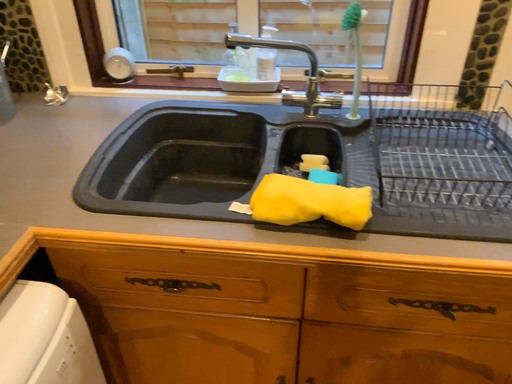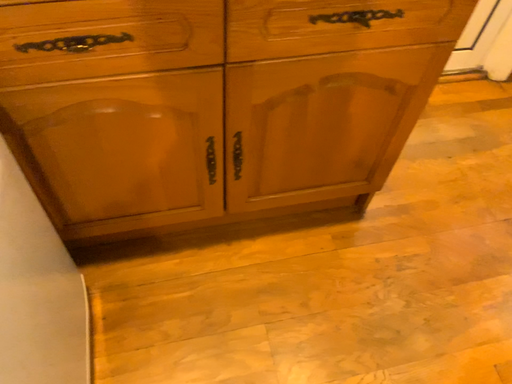
Question: Which way did the camera rotate in the video?

Choices:
 (A) rotated left
 (B) rotated right

Answer: (B)